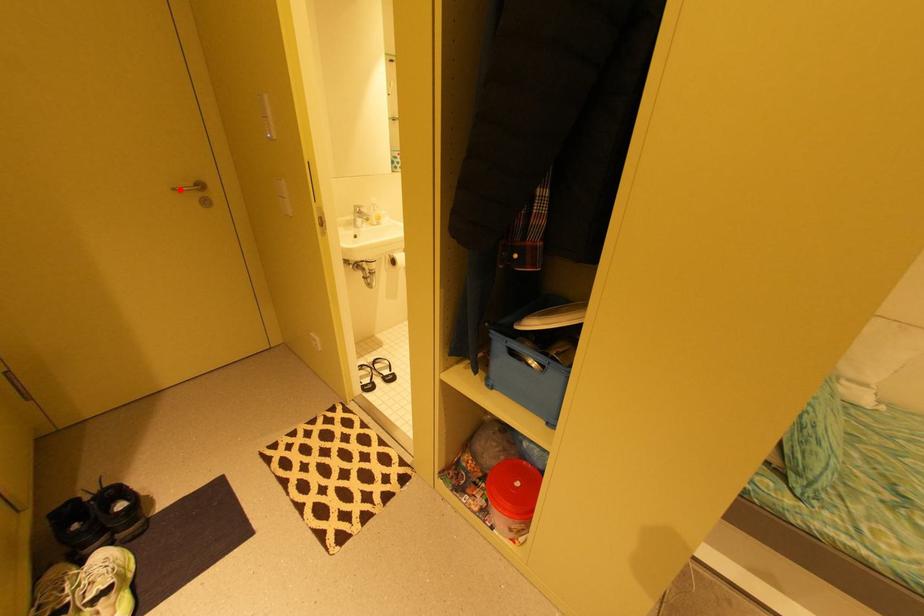
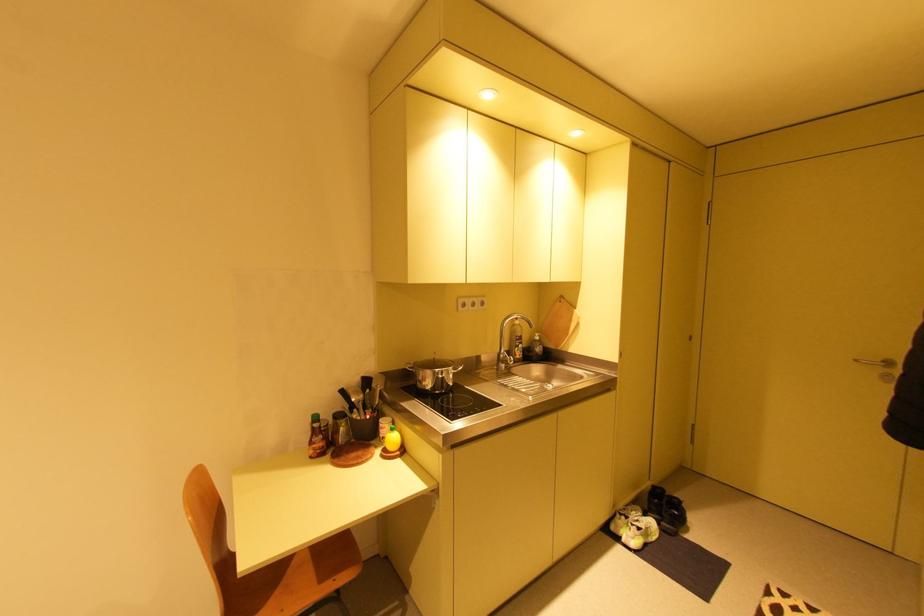
Locate, in the second image, the point that corresponds to the highlighted location in the first image.

(861, 361)